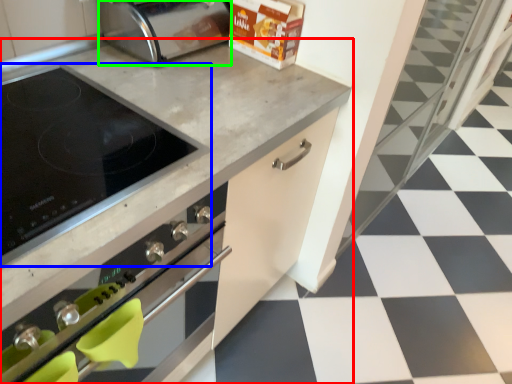
Question: Which is nearer to the countertop (highlighted by a red box)? kitchen appliance (highlighted by a blue box) or toaster (highlighted by a green box).

Choices:
 (A) kitchen appliance
 (B) toaster

Answer: (A)